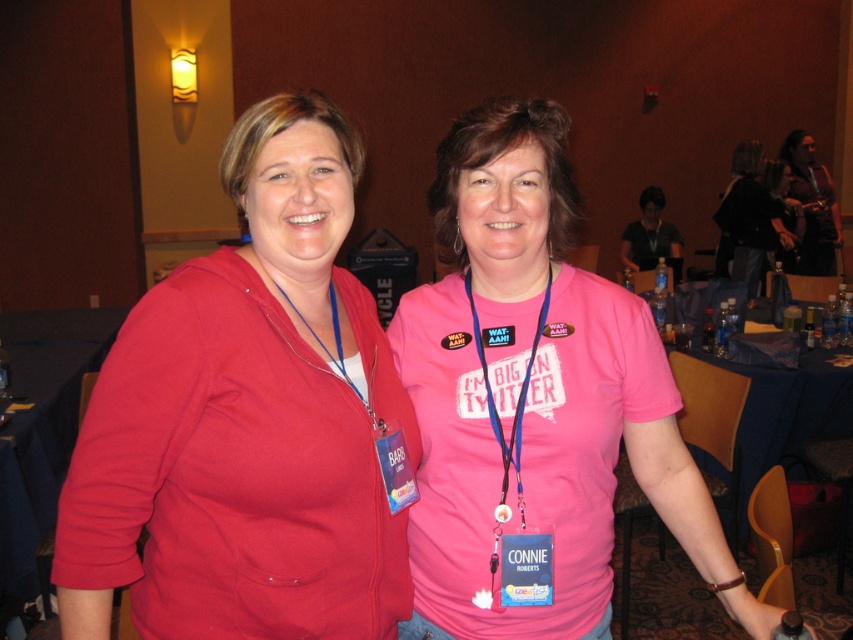
Question: Which of the following is the closest to the observer?

Choices:
 (A) matte red hoodie at left
 (B) pink fabric shirt at center

Answer: (A)

Question: Is matte red hoodie at left smaller than matte black jacket at upper right?

Choices:
 (A) no
 (B) yes

Answer: (B)

Question: Which of these objects is positioned closest to the matte red hoodie at left?

Choices:
 (A) matte black shirt at center
 (B) pink fabric shirt at center
 (C) blue fabric lanyard at center

Answer: (B)

Question: Which point is closer to the camera taking this photo?

Choices:
 (A) (793, 168)
 (B) (576, 568)

Answer: (B)

Question: Can you confirm if blue fabric lanyard at center is positioned below matte black shirt at center?

Choices:
 (A) yes
 (B) no

Answer: (A)

Question: Does matte red hoodie at left have a smaller size compared to matte black shirt at center?

Choices:
 (A) yes
 (B) no

Answer: (A)